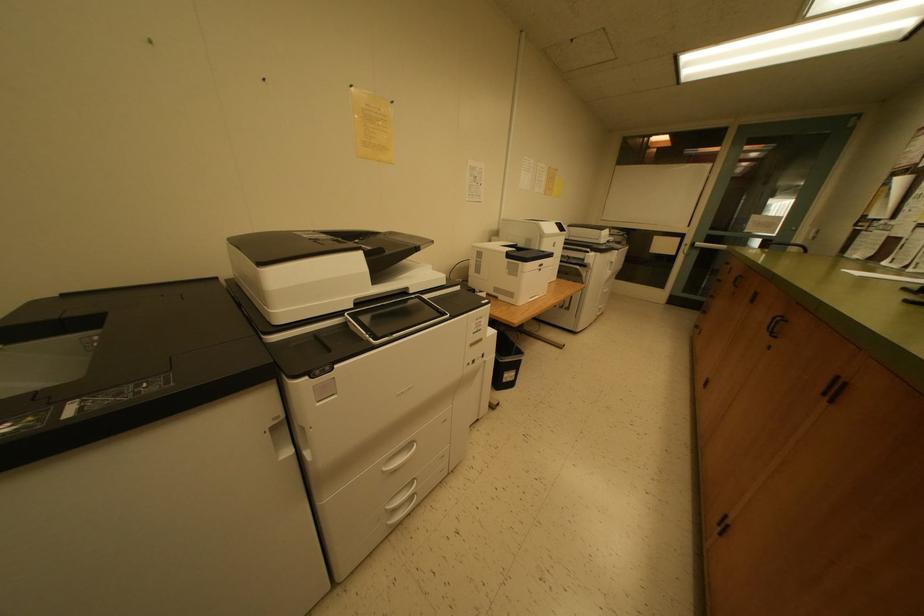
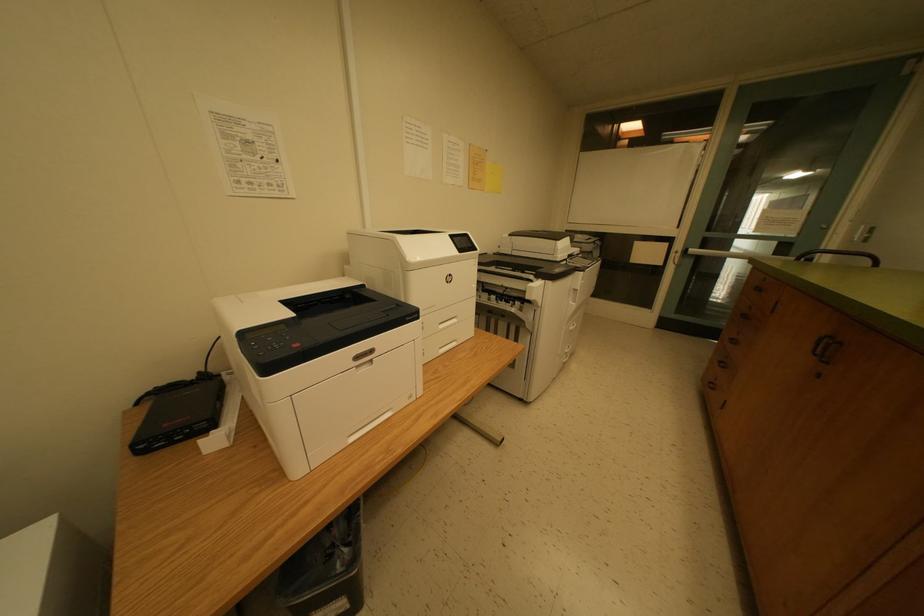
Which direction would the cameraman need to move to produce the second image?

The cameraman walked toward right, forward.